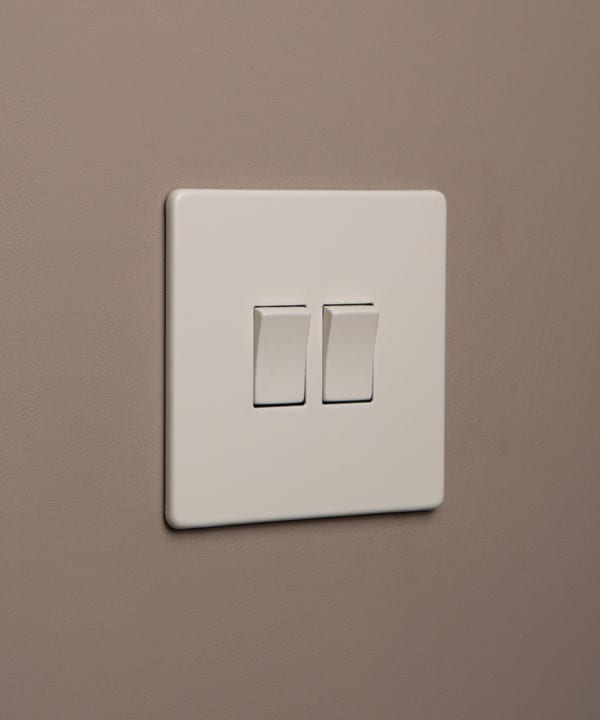
The image size is (600, 720). What are the coordinates of `rounded corners` in the screenshot? It's located at pyautogui.click(x=438, y=199), pyautogui.click(x=178, y=517), pyautogui.click(x=446, y=500), pyautogui.click(x=181, y=197).